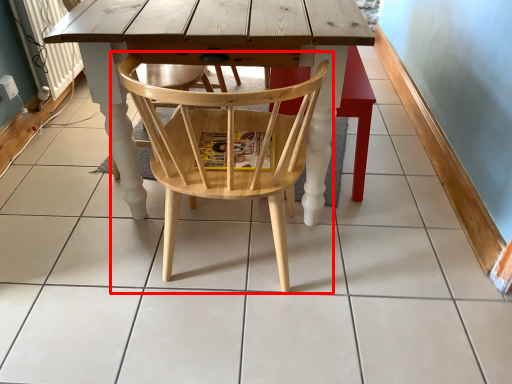
Question: From the image's perspective, considering the relative positions of chair (annotated by the red box) and bar stool in the image provided, where is chair (annotated by the red box) located with respect to the staircase?

Choices:
 (A) above
 (B) below

Answer: (B)